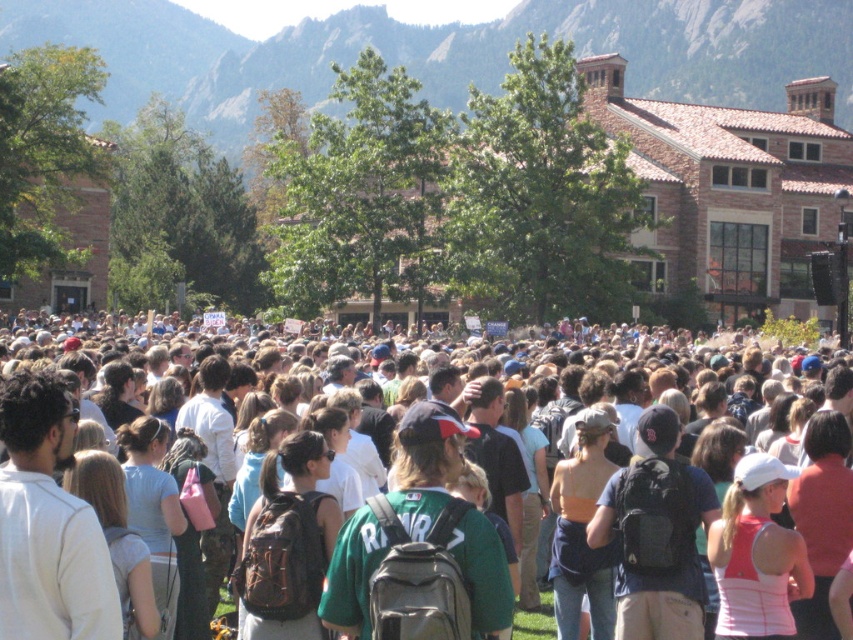
Question: Which object appears closest to the camera in this image?

Choices:
 (A) multicolored casual clothing at center
 (B) rugged stone mountain at upper center

Answer: (A)

Question: Does multicolored casual clothing at center appear on the right side of rugged stone mountain at upper center?

Choices:
 (A) no
 (B) yes

Answer: (B)

Question: Can you confirm if multicolored casual clothing at center is thinner than rugged stone mountain at upper center?

Choices:
 (A) yes
 (B) no

Answer: (A)

Question: Which object appears farthest from the camera in this image?

Choices:
 (A) multicolored casual clothing at center
 (B) rugged stone mountain at upper center

Answer: (B)

Question: In this image, where is multicolored casual clothing at center located relative to rugged stone mountain at upper center?

Choices:
 (A) above
 (B) below

Answer: (B)